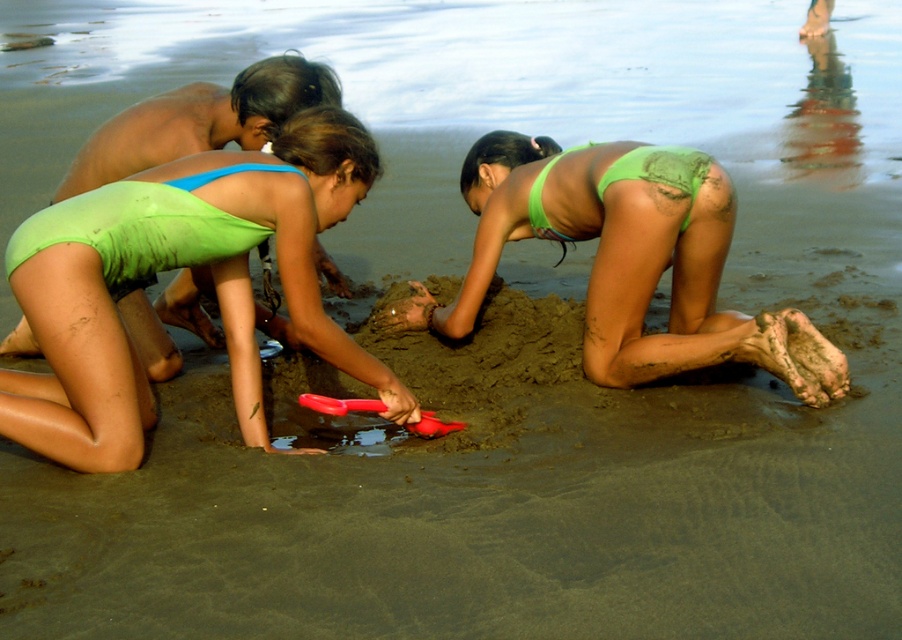
Who is positioned more to the right, green matte bikini bottom at center or rubber shovel at center?

From the viewer's perspective, green matte bikini bottom at center appears more on the right side.

Does green matte bikini bottom at center appear under rubber shovel at center?

No.

Find the location of a particular element. This screenshot has width=902, height=640. green matte bikini bottom at center is located at coordinates (628, 259).

From the picture: Is green matte swimsuit at center closer to camera compared to green matte bikini bottom at center?

That is True.

Does green matte swimsuit at center have a larger size compared to green matte bikini bottom at center?

No, green matte swimsuit at center is not bigger than green matte bikini bottom at center.

Does point (345, 124) lie behind point (571, 154)?

No, (345, 124) is closer to viewer.

The height and width of the screenshot is (640, 902). What are the coordinates of `green matte swimsuit at center` in the screenshot? It's located at (175, 268).

Which of these two, green matte swimsuit at center or rubber shovel at center, stands taller?

green matte swimsuit at center is taller.

Does green matte swimsuit at center have a smaller size compared to rubber shovel at center?

Incorrect, green matte swimsuit at center is not smaller in size than rubber shovel at center.

Is point (251, 308) closer to camera compared to point (353, 408)?

No, it is not.

Locate an element on the screen. This screenshot has height=640, width=902. green matte swimsuit at center is located at coordinates (175, 268).